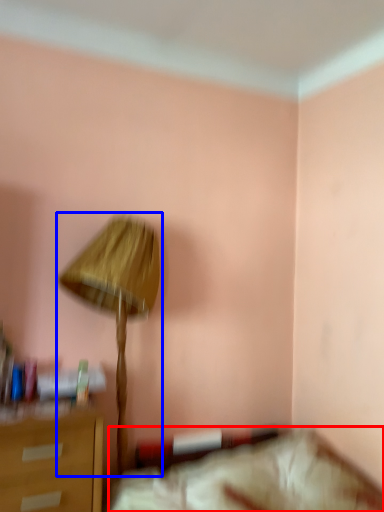
Question: Which of the following is the farthest to the observer, furniture (highlighted by a red box) or lamp (highlighted by a blue box)?

Choices:
 (A) furniture
 (B) lamp

Answer: (B)